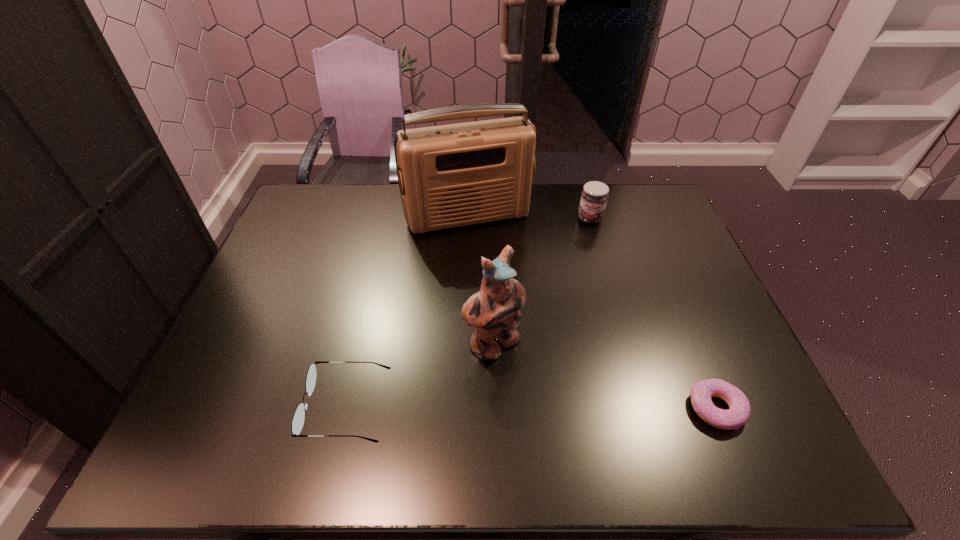
Identify the location of vacant space located 0.160m on the lenses of the fourth tallest object. (235, 407).

The height and width of the screenshot is (540, 960). In order to click on free region located 0.340m on the back of the doughnut in this screenshot , I will do `click(663, 281)`.

Image resolution: width=960 pixels, height=540 pixels. I want to click on free space located 0.300m on the front label of the third tallest object, so click(x=583, y=292).

The height and width of the screenshot is (540, 960). What are the coordinates of `free location located 0.050m on the front label of the third tallest object` in the screenshot? It's located at (588, 235).

You are a GUI agent. You are given a task and a screenshot of the screen. Output one action in this format:
    pyautogui.click(x=<x>, y=<y>)
    Task: Click on the free spot located on the front label of the third tallest object
    The width and height of the screenshot is (960, 540).
    Given the screenshot: What is the action you would take?
    pyautogui.click(x=588, y=235)

This screenshot has width=960, height=540. Find the location of `vacant region located on the front-facing side of the tallest object`. vacant region located on the front-facing side of the tallest object is located at coordinates (497, 268).

In order to click on vacant space located on the front-facing side of the tallest object in this screenshot , I will do `click(495, 264)`.

Where is `blank space located on the front-facing side of the tallest object`? The width and height of the screenshot is (960, 540). blank space located on the front-facing side of the tallest object is located at coordinates (512, 302).

Find the location of a particular element. vacant space located 0.170m on the front-facing side of the figurine is located at coordinates (566, 413).

Where is `vacant point located 0.060m on the front-facing side of the figurine`? Image resolution: width=960 pixels, height=540 pixels. vacant point located 0.060m on the front-facing side of the figurine is located at coordinates (531, 380).